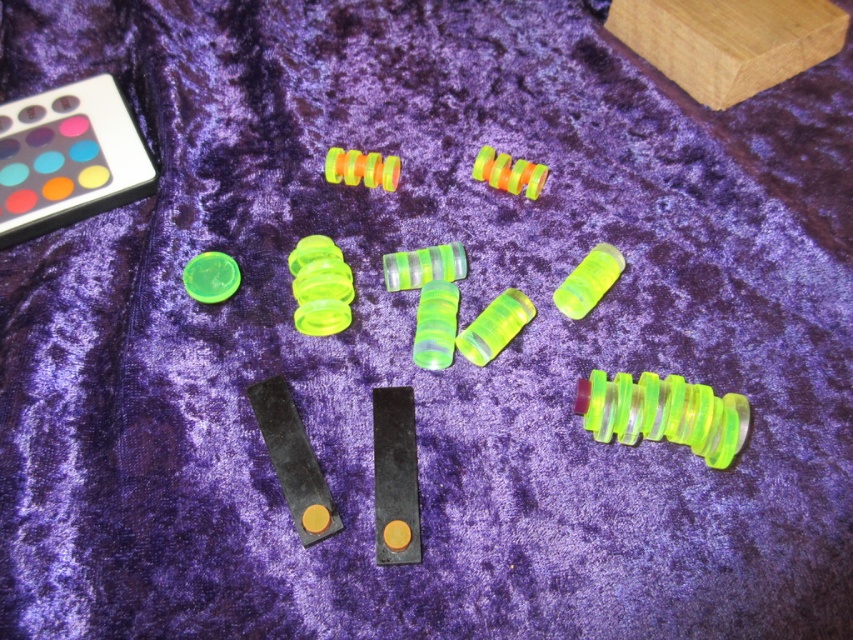
Question: Which object appears closest to the camera in this image?

Choices:
 (A) translucent neon green spring at center-right
 (B) translucent green plastic at center

Answer: (B)

Question: Does translucent neon green spring at center-right appear over translucent green plastic ring at upper left?

Choices:
 (A) yes
 (B) no

Answer: (B)

Question: Is translucent neon green spring at center-right to the right of neon plastic spiral at center from the viewer's perspective?

Choices:
 (A) no
 (B) yes

Answer: (B)

Question: Can you confirm if translucent neon green spring at center-right is thinner than neon plastic spiral at center?

Choices:
 (A) yes
 (B) no

Answer: (A)

Question: Among these objects, which one is nearest to the camera?

Choices:
 (A) translucent green plastic ring at upper left
 (B) neon plastic spiral at center
 (C) translucent neon green spring at center-right
 (D) translucent green plastic at center

Answer: (D)

Question: Among these objects, which one is nearest to the camera?

Choices:
 (A) neon translucent spring at upper right
 (B) translucent green plastic at center

Answer: (B)